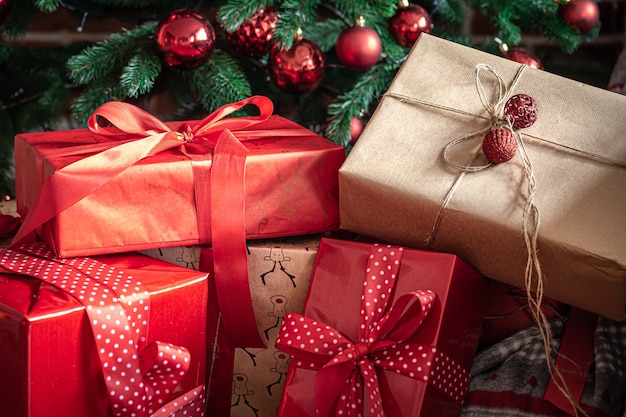
The height and width of the screenshot is (417, 626). I want to click on baubles, so click(592, 6), click(529, 59), click(521, 109), click(504, 144), click(354, 129), click(416, 24), click(369, 41), click(300, 59), click(264, 41), click(193, 43).